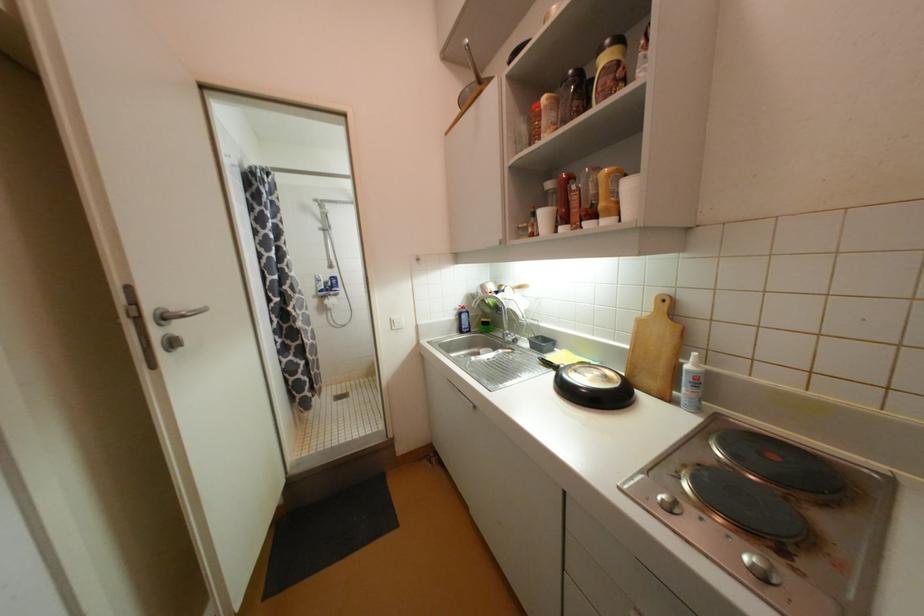
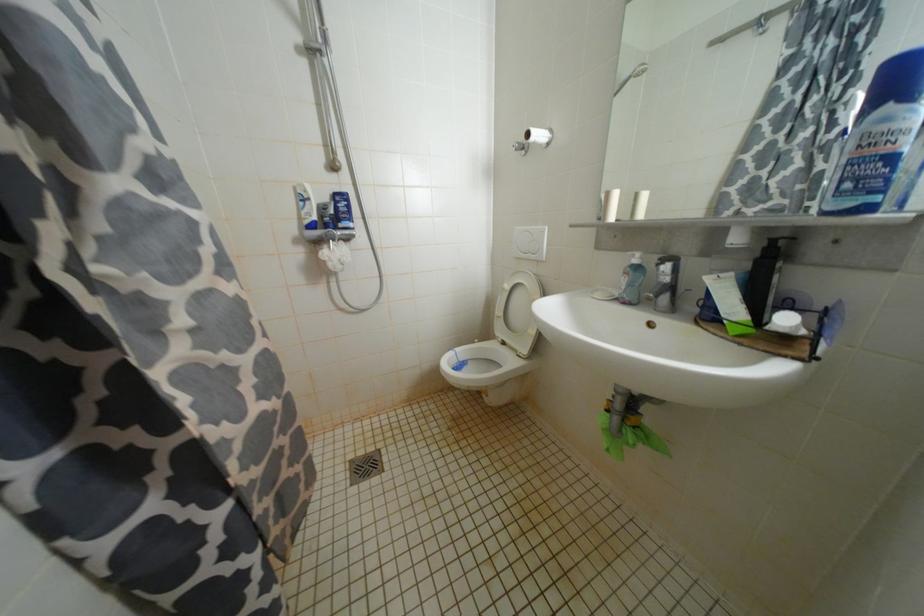
Which direction would the cameraman need to move to produce the second image?

The movement direction of the cameraman is left, forward.